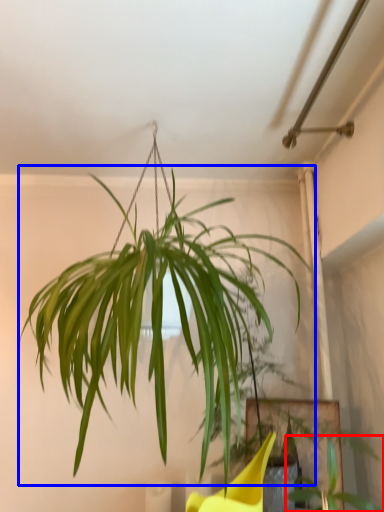
Question: Among these objects, which one is farthest to the camera, plant (highlighted by a red box) or houseplant (highlighted by a blue box)?

Choices:
 (A) plant
 (B) houseplant

Answer: (A)